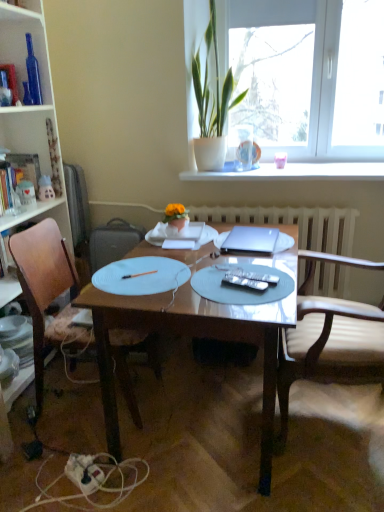
Question: From the image's perspective, is matte white plate at lower left over white paper notebook at center?

Choices:
 (A) yes
 (B) no

Answer: (B)

Question: Can you confirm if matte white plate at lower left is bigger than white paper notebook at center?

Choices:
 (A) yes
 (B) no

Answer: (A)

Question: Is white paper notebook at center at the back of matte white plate at lower left?

Choices:
 (A) no
 (B) yes

Answer: (A)

Question: Can you confirm if matte white plate at lower left is shorter than white paper notebook at center?

Choices:
 (A) yes
 (B) no

Answer: (B)

Question: Is matte white plate at lower left far away from white paper notebook at center?

Choices:
 (A) no
 (B) yes

Answer: (A)

Question: Considering the positions of hardcover book at left and matte plastic toy at left, acting as the 1th toy starting from the right, in the image, is hardcover book at left wider or thinner than matte plastic toy at left, acting as the 1th toy starting from the right,?

Choices:
 (A) wide
 (B) thin

Answer: (A)

Question: From a real-world perspective, is hardcover book at left above or below matte plastic toy at left, acting as the 1th toy starting from the right?

Choices:
 (A) below
 (B) above

Answer: (B)

Question: Considering the positions of hardcover book at left and matte plastic toy at left, acting as the 2th toy starting from the left, in the image, is hardcover book at left taller or shorter than matte plastic toy at left, acting as the 2th toy starting from the left,?

Choices:
 (A) tall
 (B) short

Answer: (A)

Question: In terms of size, does hardcover book at left appear bigger or smaller than matte plastic toy at left, acting as the 1th toy starting from the right?

Choices:
 (A) small
 (B) big

Answer: (B)

Question: Is white textured radiator at center inside or outside of satin silver laptop at center?

Choices:
 (A) outside
 (B) inside

Answer: (A)

Question: In terms of width, does white textured radiator at center look wider or thinner when compared to satin silver laptop at center?

Choices:
 (A) thin
 (B) wide

Answer: (A)

Question: In terms of height, does white textured radiator at center look taller or shorter compared to satin silver laptop at center?

Choices:
 (A) tall
 (B) short

Answer: (A)

Question: Is point (337, 230) positioned closer to the camera than point (271, 245)?

Choices:
 (A) closer
 (B) farther

Answer: (B)

Question: Is point (268, 245) closer or farther from the camera than point (357, 314)?

Choices:
 (A) farther
 (B) closer

Answer: (A)

Question: From their relative heights in the image, would you say satin silver laptop at center is taller or shorter than light brown leather chair at right, the first chair from the right?

Choices:
 (A) short
 (B) tall

Answer: (A)